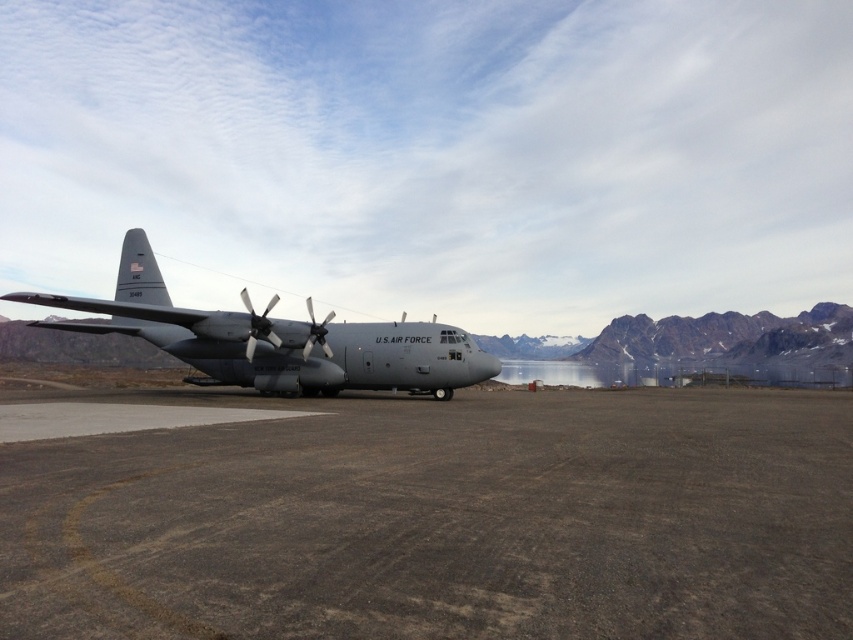
Does brown gravel at center appear over gray matte airplane at center?

No, brown gravel at center is not above gray matte airplane at center.

Is brown gravel at center behind gray matte airplane at center?

That is False.

Who is more distant from viewer, [305,432] or [380,365]?

Positioned behind is point [380,365].

The height and width of the screenshot is (640, 853). I want to click on brown gravel at center, so click(x=444, y=522).